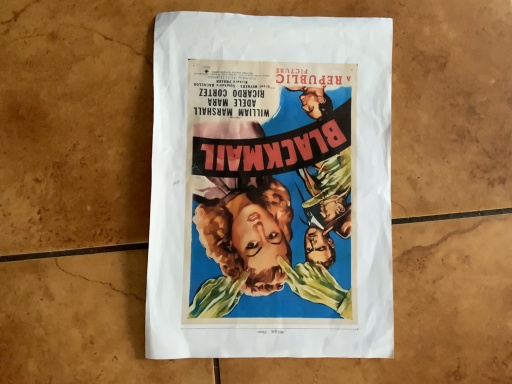
I want to click on vibrant paper poster at center, so click(x=270, y=187).

The width and height of the screenshot is (512, 384). Describe the element at coordinates (270, 187) in the screenshot. I see `vibrant paper poster at center` at that location.

Measure the distance between vibrant paper poster at center and camera.

vibrant paper poster at center and camera are 35.42 centimeters apart.

Image resolution: width=512 pixels, height=384 pixels. In order to click on vibrant paper poster at center in this screenshot , I will do `click(270, 187)`.